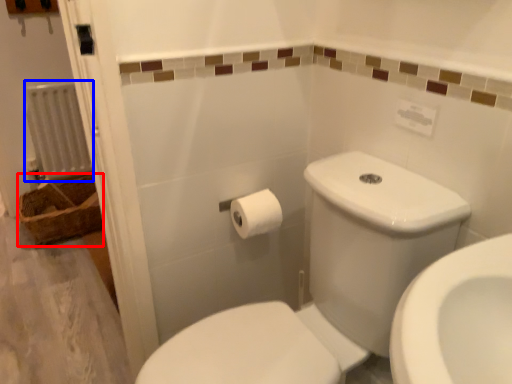
Question: Among these objects, which one is nearest to the camera, basket (highlighted by a red box) or radiator (highlighted by a blue box)?

Choices:
 (A) basket
 (B) radiator

Answer: (A)